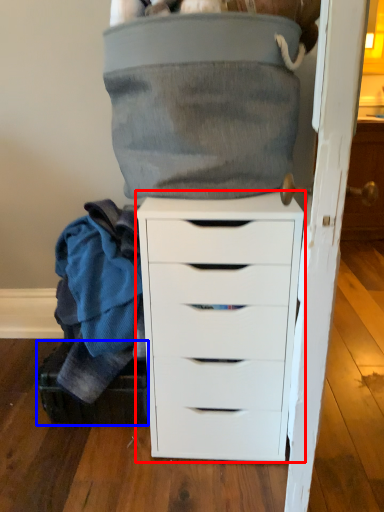
Question: Which object is closer to the camera taking this photo, chest of drawers (highlighted by a red box) or shoe box (highlighted by a blue box)?

Choices:
 (A) chest of drawers
 (B) shoe box

Answer: (A)